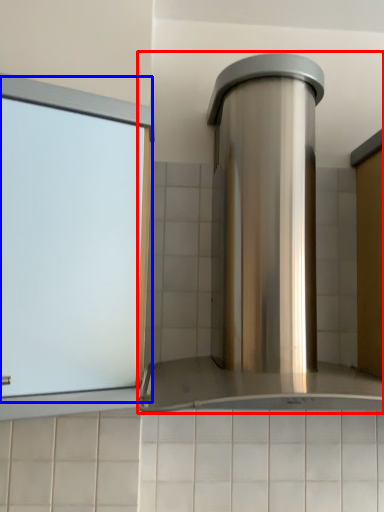
Question: Which point is closer to the camera, home appliance (highlighted by a red box) or window (highlighted by a blue box)?

Choices:
 (A) home appliance
 (B) window

Answer: (A)